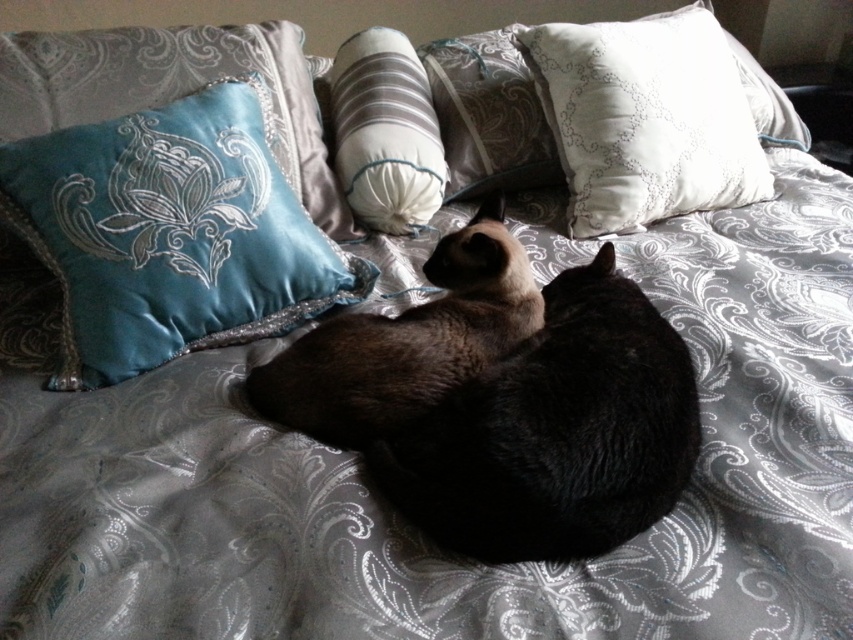
You are a cat owner who wants to place a new toy between the smokey brown fur at center and the silky white pillow at center. Since the toy is 10 cm wide, will it fit between them?

The smokey brown fur at center is bigger than the silky white pillow at center, but the exact distance between them isn not specified. Without knowing the space between them, it is impossible to determine if the 10 cm toy will fit.

You are a photographer trying to capture the cats on the bed. You want to position your camera so that the smokey brown fur at center and the white satin pillow at upper right are both in the frame. Based on their positions, which object should be placed closer to the left side of the photo?

The smokey brown fur at center should be placed closer to the left side of the photo because it is positioned to the left of the white satin pillow at upper right.

You are a cat owner who wants to place a new toy at the exact center of the bed. The bed has a smokey brown fur at center located at point (556, 433). Where should you place the toy?

You should place the toy at the smokey brown fur at center located at point (556, 433) because that is the exact center of the bed.